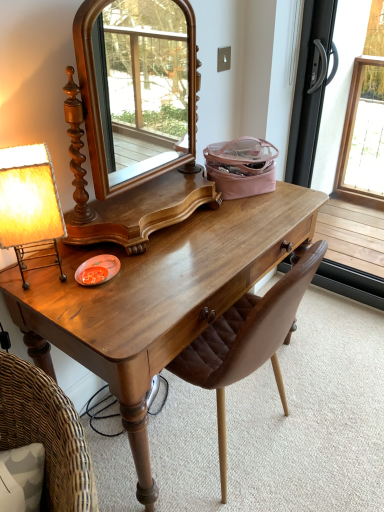
Question: Is matte yellow fabric lampshade at left not within shiny brown wooden desk at center?

Choices:
 (A) yes
 (B) no

Answer: (A)

Question: Considering the relative sizes of matte yellow fabric lampshade at left and shiny brown wooden desk at center in the image provided, is matte yellow fabric lampshade at left shorter than shiny brown wooden desk at center?

Choices:
 (A) no
 (B) yes

Answer: (B)

Question: Is matte yellow fabric lampshade at left far away from shiny brown wooden desk at center?

Choices:
 (A) no
 (B) yes

Answer: (A)

Question: Is matte yellow fabric lampshade at left oriented towards shiny brown wooden desk at center?

Choices:
 (A) yes
 (B) no

Answer: (B)

Question: Would you say matte yellow fabric lampshade at left contains shiny brown wooden desk at center?

Choices:
 (A) yes
 (B) no

Answer: (B)

Question: Does matte yellow fabric lampshade at left have a greater height compared to shiny brown wooden desk at center?

Choices:
 (A) yes
 (B) no

Answer: (B)

Question: From the image's perspective, is transparent glass screen door at right located beneath brown leather chair at center?

Choices:
 (A) no
 (B) yes

Answer: (A)

Question: Considering the relative sizes of transparent glass screen door at right and brown leather chair at center in the image provided, is transparent glass screen door at right wider than brown leather chair at center?

Choices:
 (A) no
 (B) yes

Answer: (A)

Question: Is transparent glass screen door at right further to the viewer compared to brown leather chair at center?

Choices:
 (A) no
 (B) yes

Answer: (B)

Question: From the image's perspective, is transparent glass screen door at right on top of brown leather chair at center?

Choices:
 (A) no
 (B) yes

Answer: (B)

Question: Is brown leather chair at center a part of transparent glass screen door at right?

Choices:
 (A) yes
 (B) no

Answer: (B)

Question: Can you confirm if transparent glass screen door at right is positioned to the right of brown leather chair at center?

Choices:
 (A) no
 (B) yes

Answer: (B)

Question: Considering the relative sizes of matte yellow fabric lampshade at left and transparent glass screen door at right in the image provided, is matte yellow fabric lampshade at left bigger than transparent glass screen door at right?

Choices:
 (A) yes
 (B) no

Answer: (B)